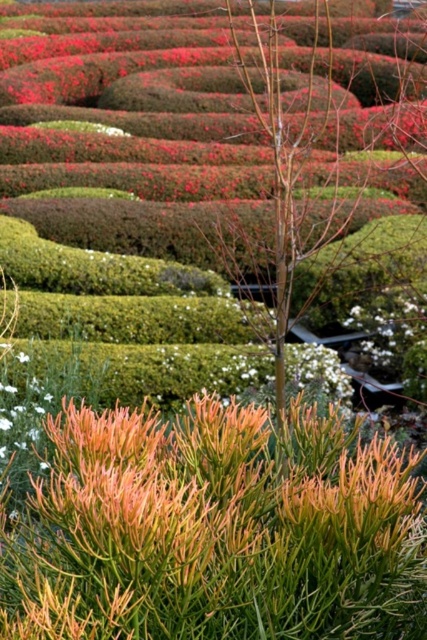
Consider the image. Can you confirm if white matte flower at center is positioned above green matte flower at center?

Yes.

The width and height of the screenshot is (427, 640). Find the location of `white matte flower at center`. white matte flower at center is located at coordinates (386, 328).

Who is more forward, (366, 352) or (20, 355)?

Point (20, 355) is in front.

Locate an element on the screen. The height and width of the screenshot is (640, 427). white matte flower at center is located at coordinates coord(386,328).